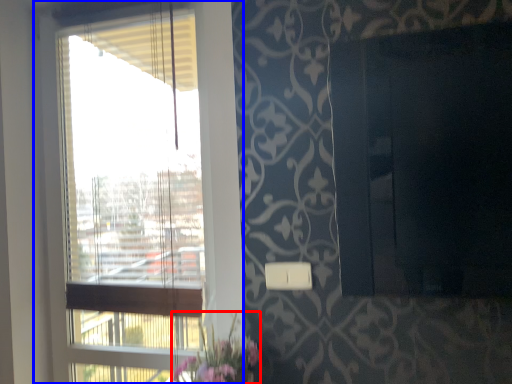
Question: Which object appears farthest to the camera in this image, floral arrangement (highlighted by a red box) or window (highlighted by a blue box)?

Choices:
 (A) floral arrangement
 (B) window

Answer: (B)